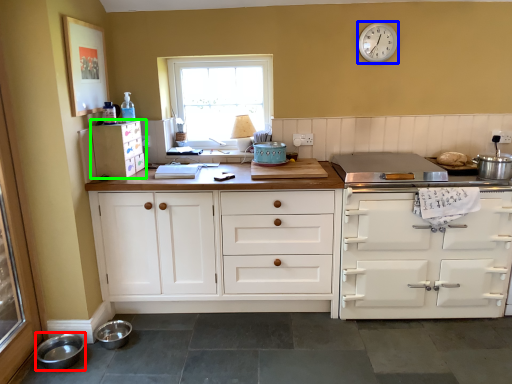
Question: Which object is positioned closest to bowl (highlighted by a red box)? Select from clock (highlighted by a blue box) and cabinetry (highlighted by a green box).

Choices:
 (A) clock
 (B) cabinetry

Answer: (B)